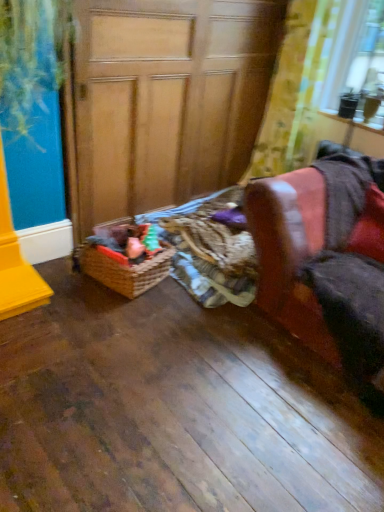
Find the location of a particular element. Image resolution: width=384 pixels, height=512 pixels. vacant area on top of woven brown basket at lower center (from a real-world perspective) is located at coordinates (137, 253).